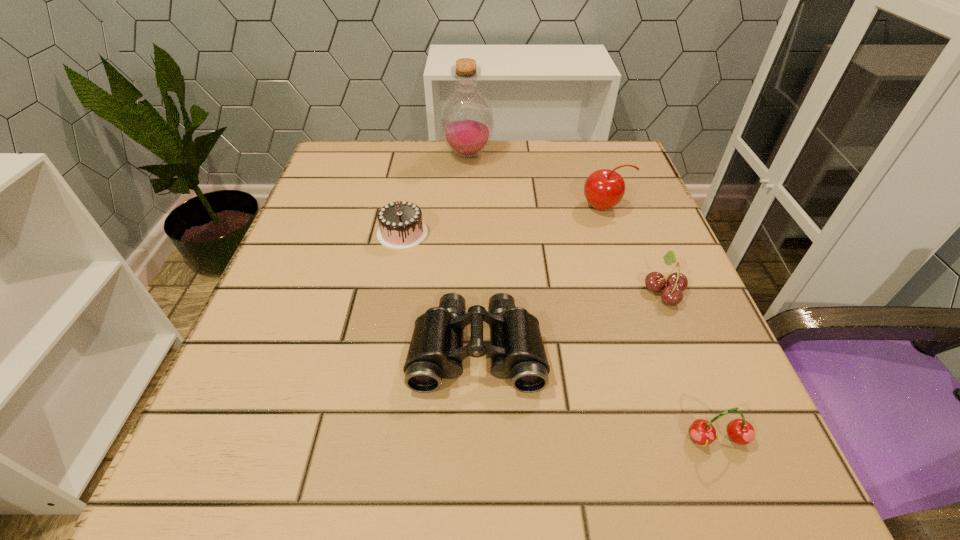
The image size is (960, 540). I want to click on vacant region at the right edge of the desktop, so click(x=621, y=231).

Identify the location of vacant space at the far left corner. tap(393, 163).

The image size is (960, 540). Find the location of `vacant region at the near left corner of the desktop`. vacant region at the near left corner of the desktop is located at coordinates (207, 486).

Find the location of a particular element. free space between the second farthest cherry and the chocolate cake is located at coordinates (533, 262).

I want to click on vacant area between the chocolate cake and the second nearest cherry, so pos(533,262).

At what (x,y) coordinates should I click in order to perform the action: click on unoccupied position between the farthest object and the fifth farthest object. Please return your answer as a coordinate pair (x, y). This screenshot has height=540, width=960. Looking at the image, I should click on (472, 252).

Find the location of a particular element. This screenshot has width=960, height=540. free point between the nearest object and the second tallest object is located at coordinates (660, 323).

The image size is (960, 540). I want to click on vacant region between the tallest cherry and the second nearest object, so click(x=540, y=278).

Identify the location of unoccupied area between the nearest cherry and the chocolate cake. This screenshot has width=960, height=540. (560, 336).

Locate an element on the screen. free area in between the binoculars and the third nearest object is located at coordinates (570, 320).